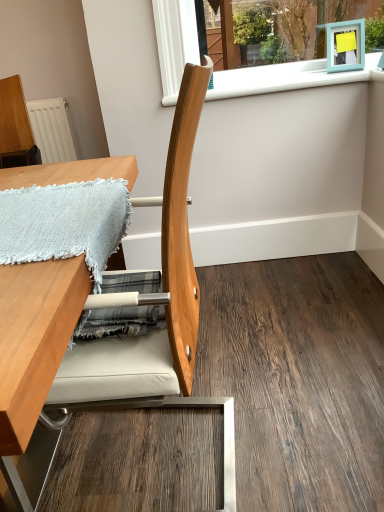
Question: Does natural wood chair at center have a lesser width compared to white plastic window sill at upper center?

Choices:
 (A) yes
 (B) no

Answer: (B)

Question: Is natural wood chair at center facing towards white plastic window sill at upper center?

Choices:
 (A) no
 (B) yes

Answer: (A)

Question: Considering the relative positions of natural wood chair at center and white plastic window sill at upper center in the image provided, is natural wood chair at center to the left of white plastic window sill at upper center from the viewer's perspective?

Choices:
 (A) no
 (B) yes

Answer: (B)

Question: Is natural wood chair at center taller than white plastic window sill at upper center?

Choices:
 (A) yes
 (B) no

Answer: (A)

Question: From the image's perspective, would you say natural wood chair at center is shown under white plastic window sill at upper center?

Choices:
 (A) yes
 (B) no

Answer: (A)

Question: Is light blue woven blanket at upper left spatially inside white plastic window sill at upper center, or outside of it?

Choices:
 (A) outside
 (B) inside

Answer: (A)

Question: From the image's perspective, is light blue woven blanket at upper left above or below white plastic window sill at upper center?

Choices:
 (A) below
 (B) above

Answer: (A)

Question: Is point (104, 263) closer or farther from the camera than point (228, 74)?

Choices:
 (A) farther
 (B) closer

Answer: (B)

Question: From a real-world perspective, is light blue woven blanket at upper left positioned above or below white plastic window sill at upper center?

Choices:
 (A) above
 (B) below

Answer: (B)

Question: Looking at their shapes, would you say wooden table at left is wider or thinner than natural wood chair at center?

Choices:
 (A) wide
 (B) thin

Answer: (A)

Question: Does point (8, 403) appear closer or farther from the camera than point (198, 315)?

Choices:
 (A) farther
 (B) closer

Answer: (B)

Question: In the image, is wooden table at left on the left side or the right side of natural wood chair at center?

Choices:
 (A) left
 (B) right

Answer: (A)

Question: Is wooden table at left inside or outside of natural wood chair at center?

Choices:
 (A) inside
 (B) outside

Answer: (B)

Question: Is point (187, 146) positioned closer to the camera than point (18, 340)?

Choices:
 (A) closer
 (B) farther

Answer: (B)

Question: In terms of height, does natural wood chair at center look taller or shorter compared to wooden table at left?

Choices:
 (A) short
 (B) tall

Answer: (B)